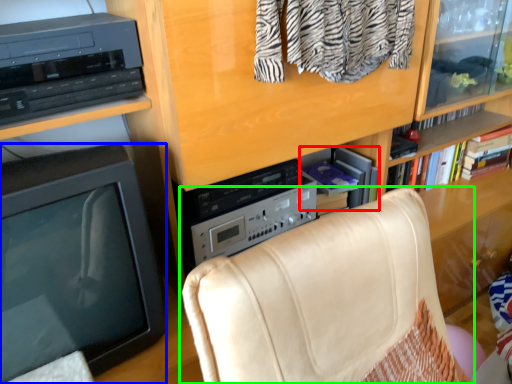
Question: Considering the real-world distances, which object is closest to book (highlighted by a red box)? television (highlighted by a blue box) or chair (highlighted by a green box).

Choices:
 (A) television
 (B) chair

Answer: (B)